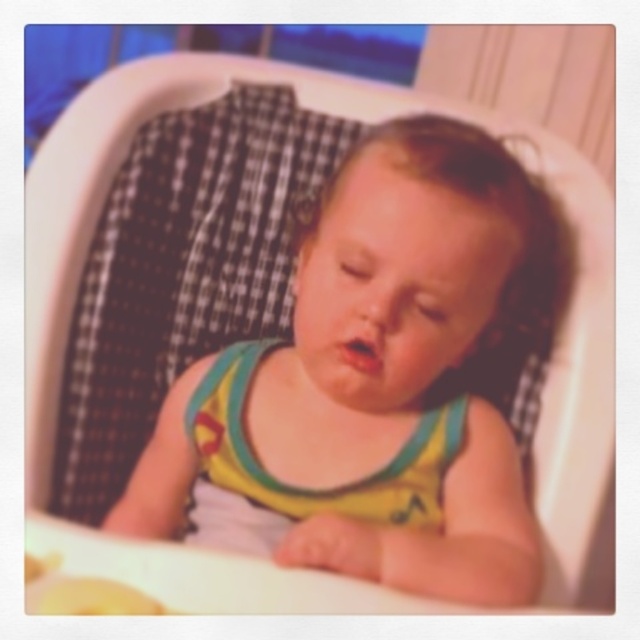
Is yellow-green fabric toddler at center shorter than yellow fabric bib at center?

In fact, yellow-green fabric toddler at center may be taller than yellow fabric bib at center.

How much distance is there between yellow-green fabric toddler at center and yellow fabric bib at center?

yellow-green fabric toddler at center is 3.46 inches away from yellow fabric bib at center.

What do you see at coordinates (387, 369) in the screenshot?
I see `yellow-green fabric toddler at center` at bounding box center [387, 369].

This screenshot has height=640, width=640. Find the location of `yellow-green fabric toddler at center`. yellow-green fabric toddler at center is located at coordinates (387, 369).